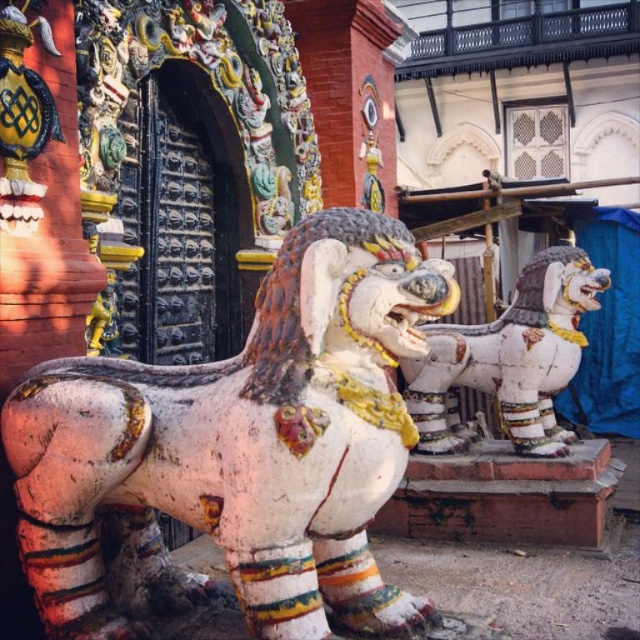
Between painted wood lion at center and white painted stone lion at center, which one is positioned higher?

white painted stone lion at center is above.

Who is taller, painted wood lion at center or white painted stone lion at center?

With more height is painted wood lion at center.

Is point (74, 422) positioned after point (552, 401)?

No, (74, 422) is in front of (552, 401).

Locate an element on the screen. painted wood lion at center is located at coordinates (243, 442).